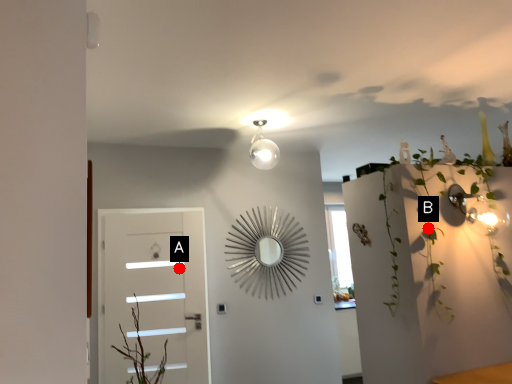
Question: Two points are circled on the image, labeled by A and B beside each circle. Which point is farther from the camera taking this photo?

Choices:
 (A) A is further
 (B) B is further

Answer: (A)